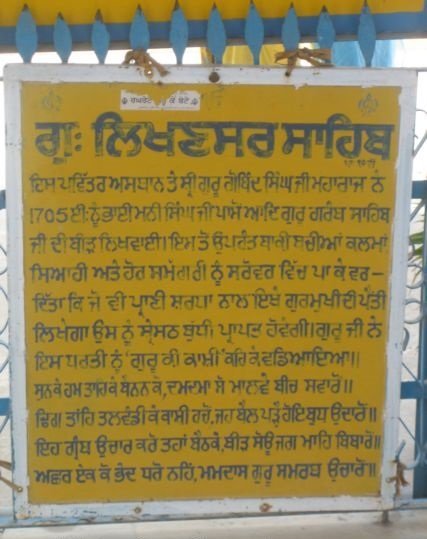
Identify the location of yellow wall above fence. (189, 10).